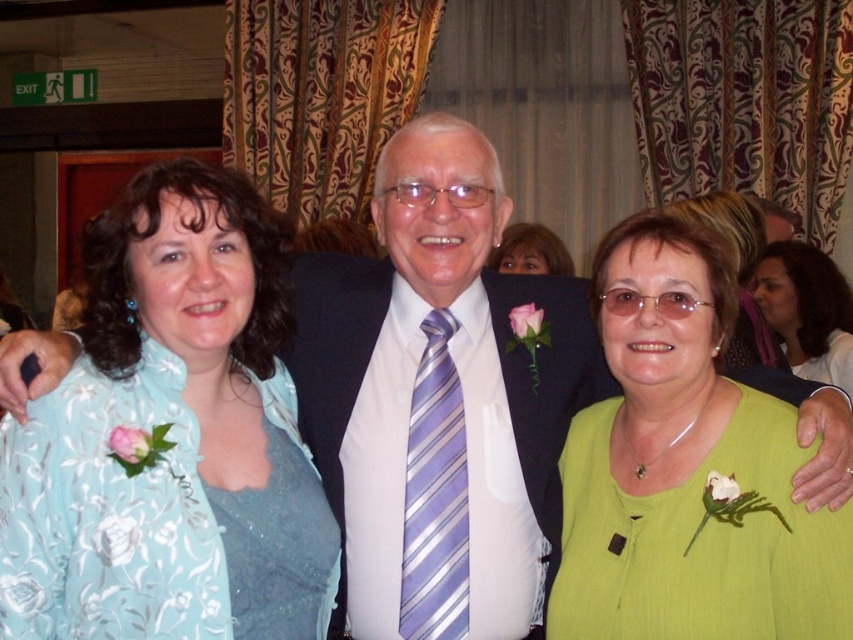
You are a photographer adjusting the lighting for a group photo. You notice the green fabric at center and the lavender striped tie at center. Which object is positioned higher in the frame?

The green fabric at center is located above the lavender striped tie at center, so it is positioned higher in the frame.

Looking at this image, you are a photographer adjusting the camera height to ensure both the green fabric at center and the light blue floral blouse at center are fully visible in the frame. Which one requires you to adjust the camera upwards to capture its full length?

The green fabric at center is shorter than the light blue floral blouse at center, so you would need to adjust the camera upwards to ensure the full length of the light blue floral blouse at center is captured while still including the green fabric at center.